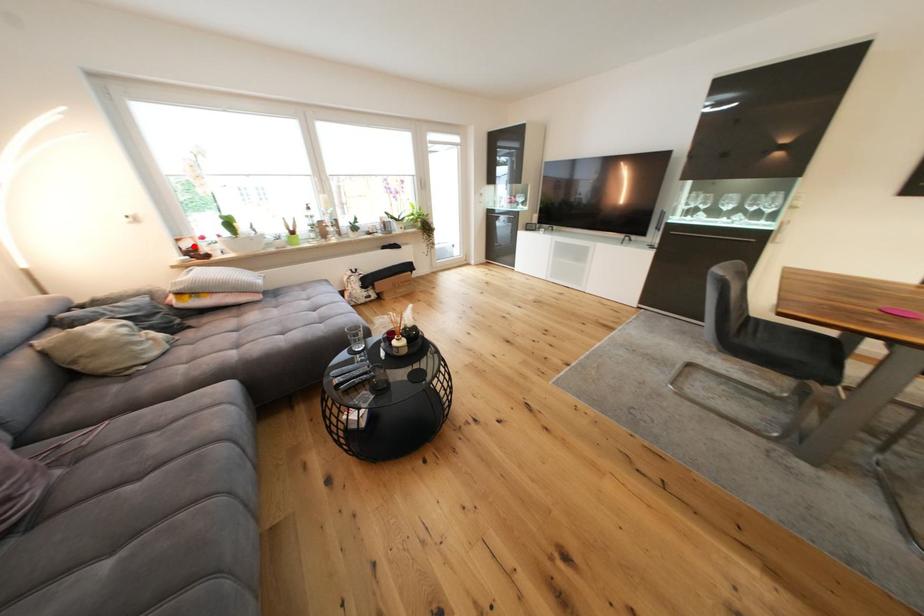
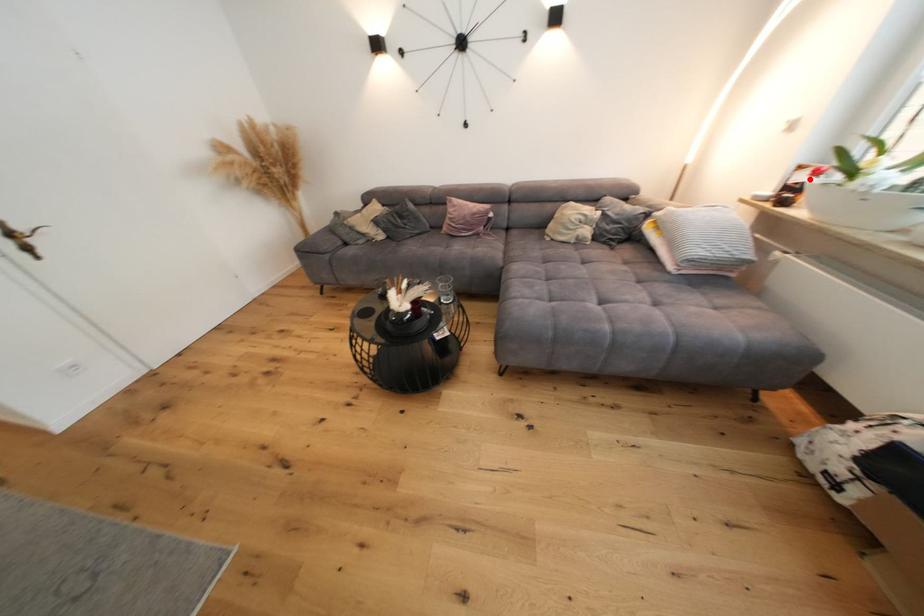
I am providing you with two images of the same scene from different viewpoints. A red point is marked on the first image and another point is marked on the second image. Are the points marked in image1 and image2 representing the same 3D position?

Yes